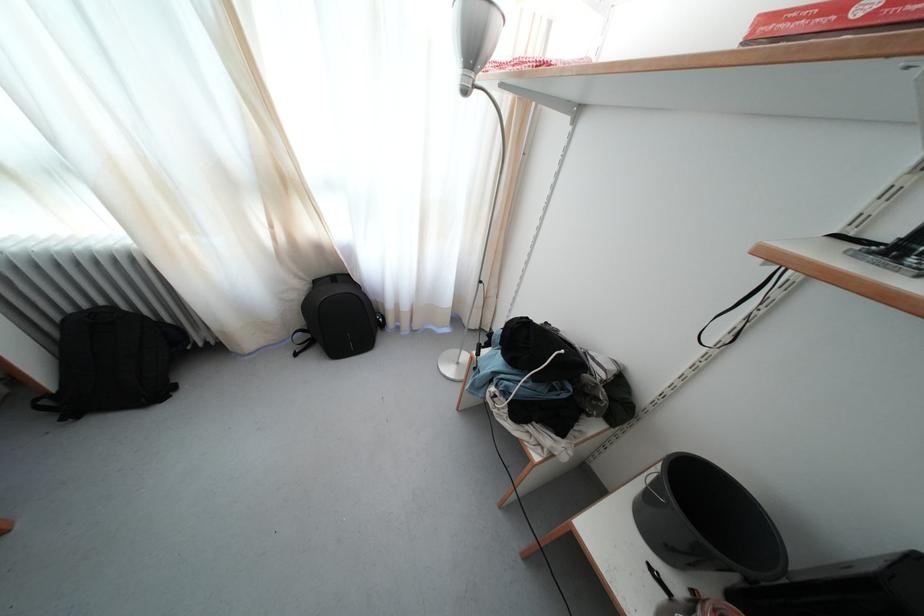
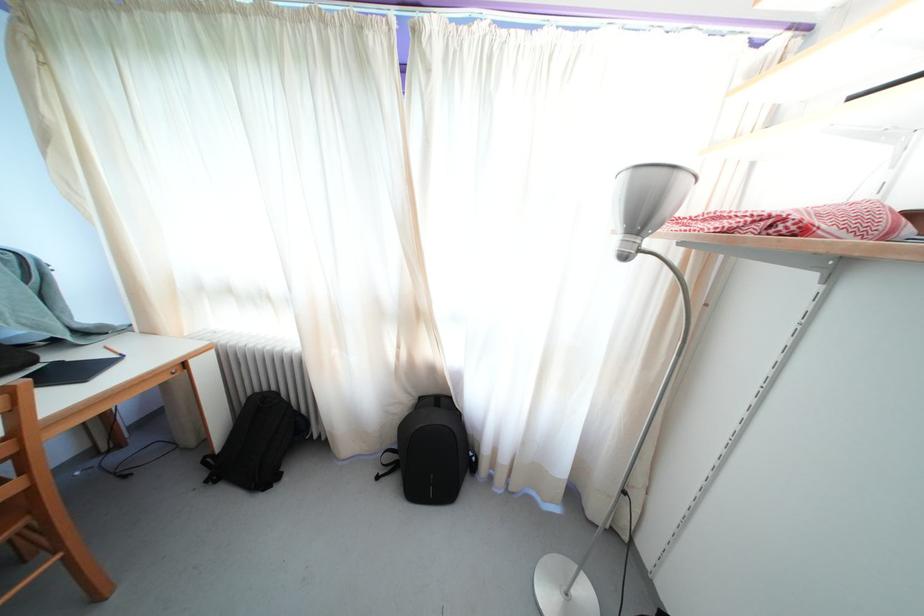
Where in the second image is the point corresponding to [161,400] from the first image?

(271, 485)